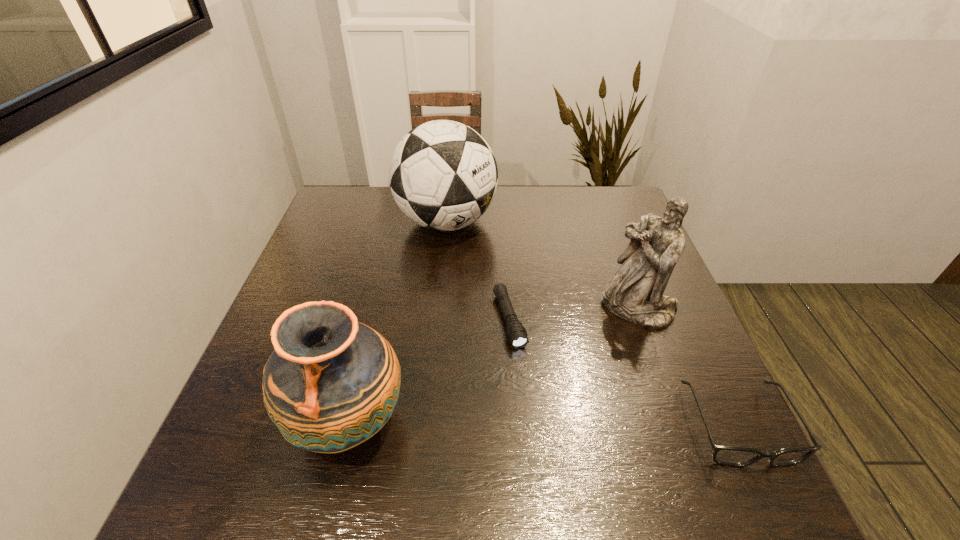
Find the location of a particular element. The width and height of the screenshot is (960, 540). free location located 0.290m on the surface of the farthest object where the brand logo is visible is located at coordinates (498, 326).

The image size is (960, 540). What are the coordinates of `vacant space situated 0.320m on the surface of the farthest object where the brand logo is visible` in the screenshot? It's located at (502, 335).

Identify the location of free spot located at the lens end of the flashlight. tap(523, 373).

This screenshot has width=960, height=540. I want to click on vacant space located at the lens end of the flashlight, so point(537,411).

Locate an element on the screen. The image size is (960, 540). vacant space located 0.100m at the lens end of the flashlight is located at coordinates (529, 389).

Where is `object present at the far edge`? The height and width of the screenshot is (540, 960). object present at the far edge is located at coordinates tap(443, 175).

What are the coordinates of `pottery positioned at the near edge` in the screenshot? It's located at point(332,383).

You are a GUI agent. You are given a task and a screenshot of the screen. Output one action in this format:
    pyautogui.click(x=<x>, y=<y>)
    Task: Click on the spectacles located in the near edge section of the desktop
    The image size is (960, 540).
    Given the screenshot: What is the action you would take?
    pyautogui.click(x=734, y=456)

Identify the location of object positioned at the left edge. (332, 383).

The height and width of the screenshot is (540, 960). In order to click on spectacles present at the right edge in this screenshot , I will do `click(734, 456)`.